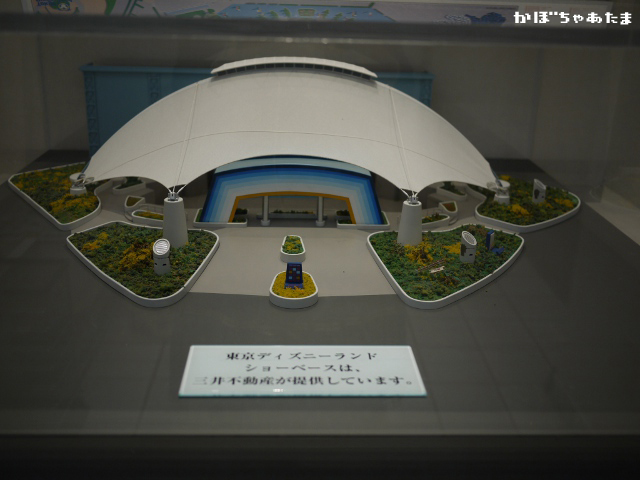
Where is `blue curtain`? This screenshot has height=480, width=640. blue curtain is located at coordinates (111, 92), (425, 89).